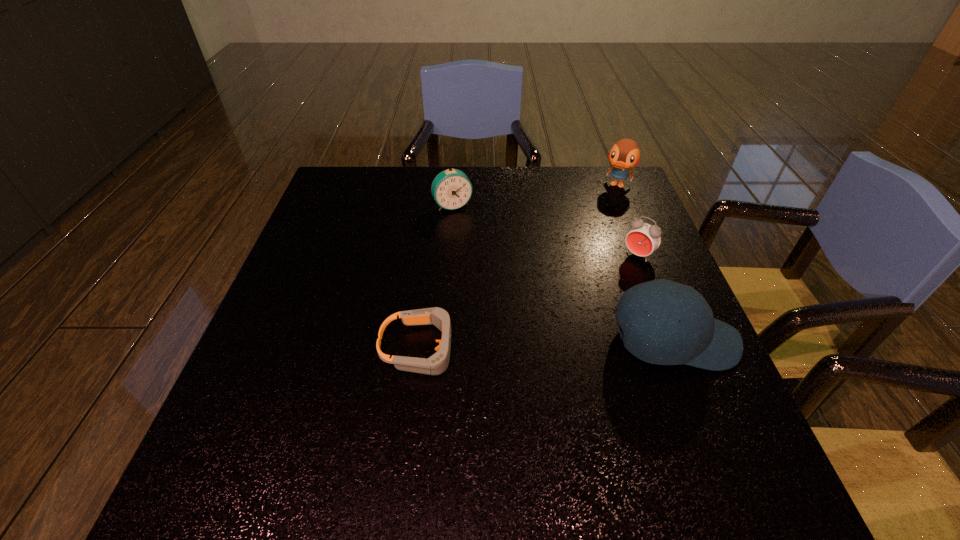
This screenshot has height=540, width=960. In order to click on alarm clock present at the right edge in this screenshot , I will do [x=644, y=238].

Locate an element on the screen. The width and height of the screenshot is (960, 540). duck present at the right edge is located at coordinates (625, 154).

Find the location of a particular element. The image size is (960, 540). object situated at the far right corner is located at coordinates (625, 154).

What are the coordinates of `blank space at the far edge of the desktop` in the screenshot? It's located at (511, 171).

This screenshot has height=540, width=960. I want to click on vacant area at the near edge of the desktop, so click(488, 399).

Find the location of a particular element. The height and width of the screenshot is (540, 960). vacant space at the left edge is located at coordinates (341, 220).

The width and height of the screenshot is (960, 540). I want to click on free region at the right edge of the desktop, so click(x=601, y=245).

In the image, there is a desktop. At what (x,y) coordinates should I click in order to perform the action: click on vacant space at the near left corner. Please return your answer as a coordinate pair (x, y). Looking at the image, I should click on (283, 440).

This screenshot has width=960, height=540. In the image, there is a desktop. In order to click on vacant area at the far right corner in this screenshot , I will do `click(636, 200)`.

Where is `empty space between the third nearest object and the duck`? The width and height of the screenshot is (960, 540). empty space between the third nearest object and the duck is located at coordinates (628, 220).